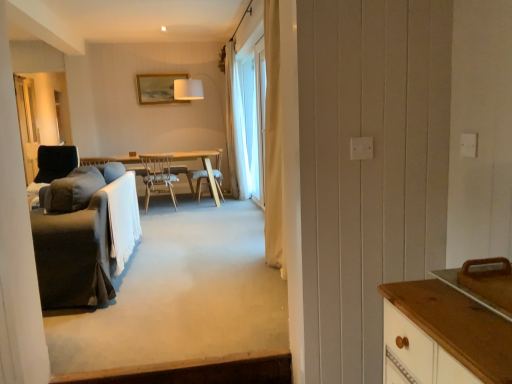
Question: Can you confirm if soft gray carpet at center is taller than white sheer curtain at center?

Choices:
 (A) yes
 (B) no

Answer: (B)

Question: Is soft gray carpet at center surrounding white sheer curtain at center?

Choices:
 (A) no
 (B) yes

Answer: (A)

Question: Does soft gray carpet at center have a smaller size compared to white sheer curtain at center?

Choices:
 (A) yes
 (B) no

Answer: (B)

Question: Could you tell me if soft gray carpet at center is turned towards white sheer curtain at center?

Choices:
 (A) yes
 (B) no

Answer: (B)

Question: Can you confirm if soft gray carpet at center is positioned to the left of white sheer curtain at center?

Choices:
 (A) no
 (B) yes

Answer: (B)

Question: Are soft gray carpet at center and white sheer curtain at center located far from each other?

Choices:
 (A) no
 (B) yes

Answer: (B)

Question: Is soft gray carpet at center at the back of white sheer curtain at center?

Choices:
 (A) yes
 (B) no

Answer: (B)

Question: Does white sheer curtain at center turn towards soft gray carpet at center?

Choices:
 (A) yes
 (B) no

Answer: (B)

Question: Does white sheer curtain at center have a larger size compared to soft gray carpet at center?

Choices:
 (A) yes
 (B) no

Answer: (B)

Question: Can you confirm if white sheer curtain at center is thinner than soft gray carpet at center?

Choices:
 (A) no
 (B) yes

Answer: (B)

Question: From the image's perspective, is white sheer curtain at center located beneath soft gray carpet at center?

Choices:
 (A) yes
 (B) no

Answer: (B)

Question: Is white sheer curtain at center touching soft gray carpet at center?

Choices:
 (A) yes
 (B) no

Answer: (B)

Question: From a real-world perspective, is black fabric screen door at left physically below wooden frame at upper center?

Choices:
 (A) yes
 (B) no

Answer: (A)